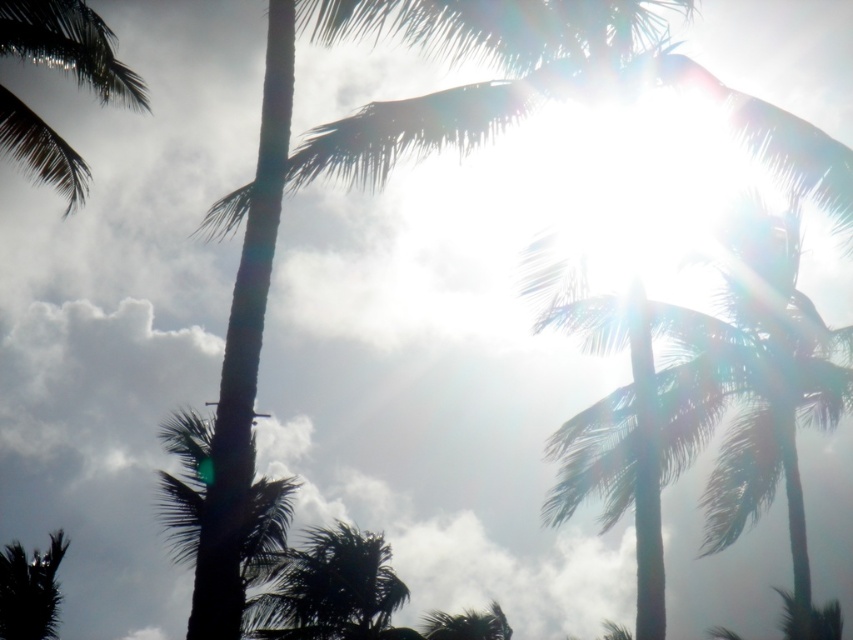
Looking at this image, can you confirm if dark green leafy palm tree at center is positioned below green leafy palm tree at lower center?

Incorrect, dark green leafy palm tree at center is not positioned below green leafy palm tree at lower center.

Between point (370, 602) and point (432, 620), which one is positioned in front?

Positioned in front is point (370, 602).

Locate an element on the screen. This screenshot has width=853, height=640. dark green leafy palm tree at center is located at coordinates (335, 589).

Between point (303, 625) and point (12, 595), which one is positioned behind?

The point (303, 625) is behind.

Is point (399, 588) farther from viewer compared to point (45, 570)?

Yes, point (399, 588) is behind point (45, 570).

Find the location of a particular element. Image resolution: width=853 pixels, height=640 pixels. dark green leafy palm tree at center is located at coordinates (335, 589).

The width and height of the screenshot is (853, 640). In order to click on green leafy palm tree at upper left in this screenshot , I will do `click(68, 45)`.

Can you confirm if green leafy palm tree at upper left is positioned to the right of dark green leafy palm tree at center?

Incorrect, green leafy palm tree at upper left is not on the right side of dark green leafy palm tree at center.

Is point (74, 44) farther from camera compared to point (276, 611)?

No, it is in front of (276, 611).

I want to click on green leafy palm tree at upper left, so click(x=68, y=45).